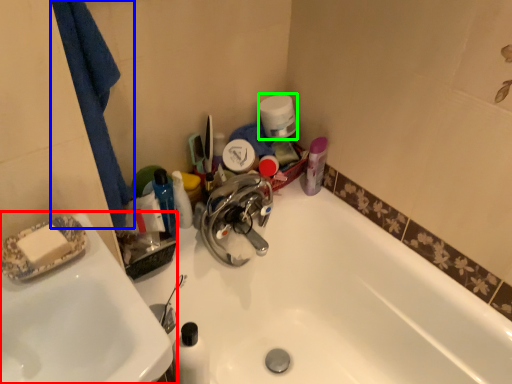
Question: Which object is positioned closest to sink (highlighted by a red box)? Select from bath towel (highlighted by a blue box) and toilet paper (highlighted by a green box).

Choices:
 (A) bath towel
 (B) toilet paper

Answer: (A)